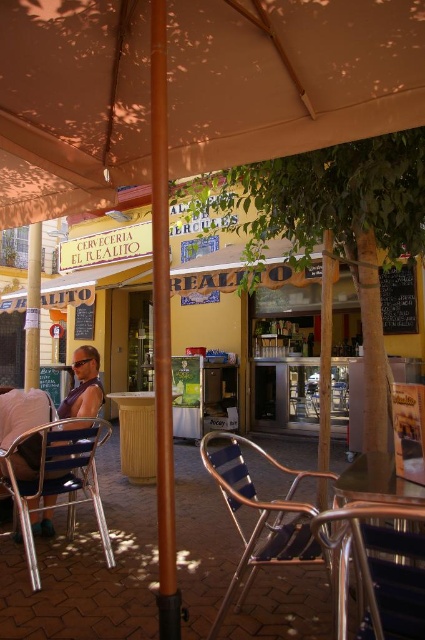
Question: Can you confirm if metallic blue striped chair at center is positioned to the left of metallic pole at left?

Choices:
 (A) no
 (B) yes

Answer: (A)

Question: Does brown polished pole at center have a smaller size compared to metallic blue chair at lower center?

Choices:
 (A) no
 (B) yes

Answer: (A)

Question: Which point is closer to the camera?

Choices:
 (A) (167, 428)
 (B) (19, 148)

Answer: (A)

Question: Is brown polished pole at center bigger than metallic blue chair at lower center?

Choices:
 (A) no
 (B) yes

Answer: (B)

Question: Which object appears farthest from the camera in this image?

Choices:
 (A) brown wooden pole at center
 (B) metallic blue striped chair at center

Answer: (A)

Question: Among these points, which one is farthest from the camera?

Choices:
 (A) (322, 486)
 (B) (167, 596)
 (C) (240, 524)

Answer: (C)